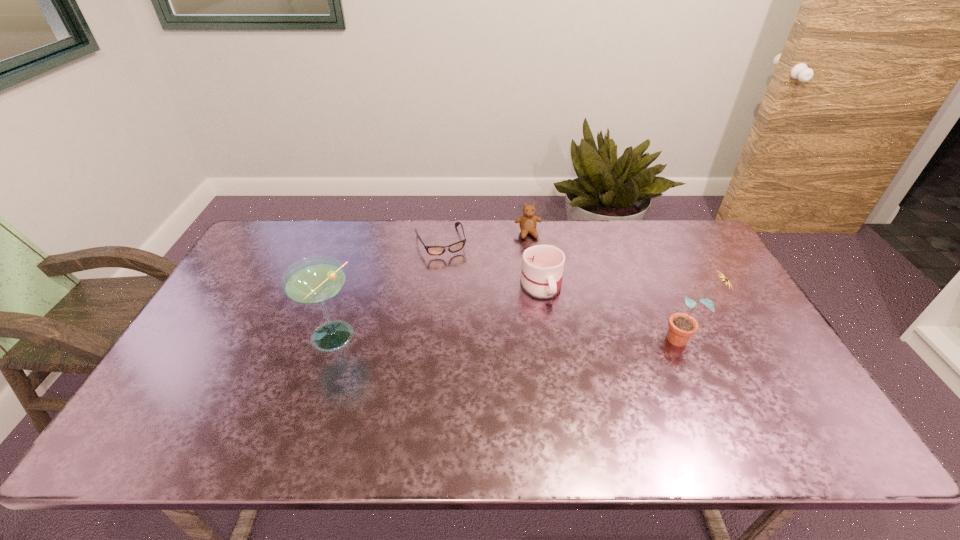
Where is `vacant point located between the sunflower and the teddy bear`? vacant point located between the sunflower and the teddy bear is located at coordinates (607, 286).

You are a GUI agent. You are given a task and a screenshot of the screen. Output one action in this format:
    pyautogui.click(x=<x>, y=<y>)
    Task: Click on the free space between the leftmost object and the second object from left to right
    The height and width of the screenshot is (540, 960).
    Given the screenshot: What is the action you would take?
    pyautogui.click(x=386, y=290)

At what (x,y) coordinates should I click in order to perform the action: click on vacant space in between the third farthest object and the fourth object from right to left. Please return your answer as a coordinate pair (x, y). Looking at the image, I should click on (491, 264).

The width and height of the screenshot is (960, 540). What are the coordinates of `vacant point located between the leftmost object and the shortest object` in the screenshot? It's located at (386, 290).

Identify which object is the third nearest to the mug. Please provide its 2D coordinates. Your answer should be formatted as a tuple, i.e. [(x, y)], where the tuple contains the x and y coordinates of a point satisfying the conditions above.

[(682, 326)]

Identify which object is the third nearest to the rightmost object. Please provide its 2D coordinates. Your answer should be formatted as a tuple, i.e. [(x, y)], where the tuple contains the x and y coordinates of a point satisfying the conditions above.

[(455, 247)]

You are a GUI agent. You are given a task and a screenshot of the screen. Output one action in this format:
    pyautogui.click(x=<x>, y=<y>)
    Task: Click on the free space that satisfies the following two spatial constraints: 1. on the front side of the teddy bear; 2. on the left side of the third farthest object
    
    Given the screenshot: What is the action you would take?
    pyautogui.click(x=535, y=286)

You are a GUI agent. You are given a task and a screenshot of the screen. Output one action in this format:
    pyautogui.click(x=<x>, y=<y>)
    Task: Click on the vacant space that satisfies the following two spatial constraints: 1. on the front side of the shortest object; 2. on the left side of the third nearest object
    
    Given the screenshot: What is the action you would take?
    click(x=436, y=286)

You are a GUI agent. You are given a task and a screenshot of the screen. Output one action in this format:
    pyautogui.click(x=<x>, y=<y>)
    Task: Click on the free point that satisfies the following two spatial constraints: 1. on the back side of the mug; 2. on the right side of the leftmost object
    Image resolution: width=960 pixels, height=540 pixels.
    Given the screenshot: What is the action you would take?
    pyautogui.click(x=349, y=286)